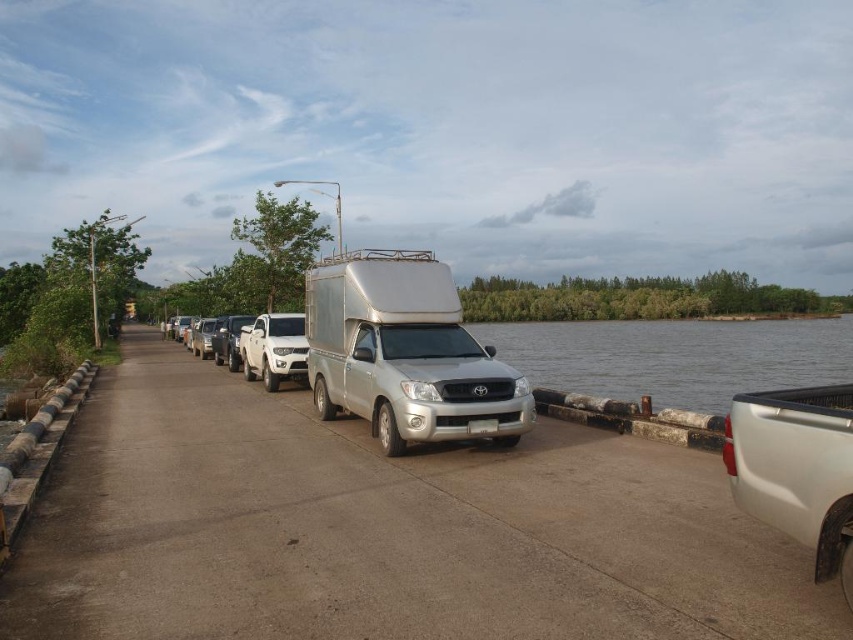
You are driving a car and want to park it near the white matte truck at center without getting your car wet. Based on the scene, where should you park relative to the gray water at right?

The gray water at right is above the white matte truck at center, so to avoid getting your car wet, you should park below the white matte truck at center, away from the gray water at right.

You are standing at the point marked by the coordinates point [675,356] in the image. Looking around, what large body of water can you see in the scene?

The point 0.552, 0.792 is on gray water at right, so the large body of water you can see is the gray water at right.